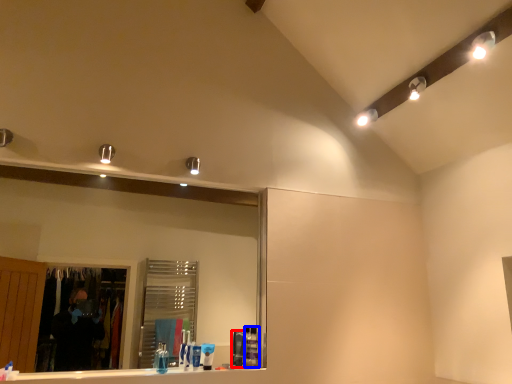
Question: Which object appears closest to the camera in this image, toiletry (highlighted by a red box) or toiletry (highlighted by a blue box)?

Choices:
 (A) toiletry
 (B) toiletry

Answer: (A)